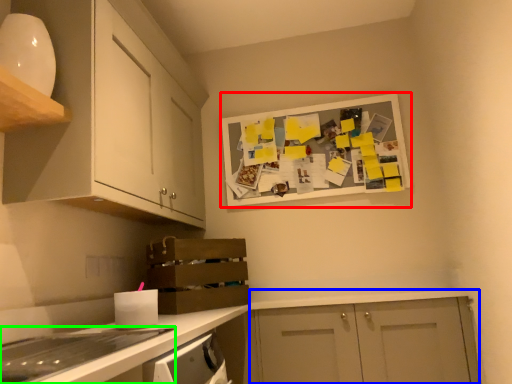
Question: Considering the real-world distances, which object is farthest from bulletin board (highlighted by a red box)? cabinetry (highlighted by a blue box) or home appliance (highlighted by a green box)?

Choices:
 (A) cabinetry
 (B) home appliance

Answer: (B)